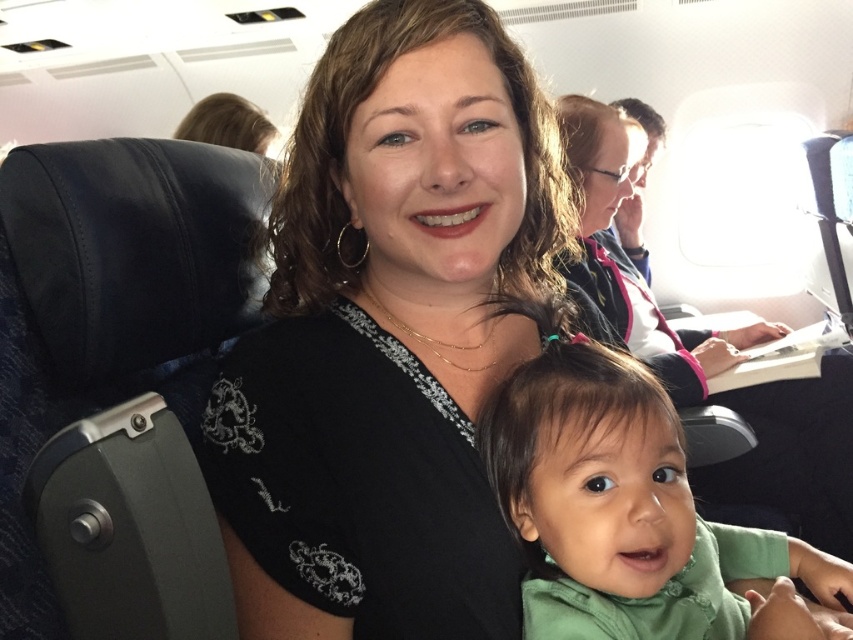
This screenshot has height=640, width=853. What do you see at coordinates (390, 336) in the screenshot?
I see `black embroidered shirt at center` at bounding box center [390, 336].

Find the location of a particular element. The height and width of the screenshot is (640, 853). black embroidered shirt at center is located at coordinates pyautogui.click(x=390, y=336).

I want to click on black embroidered shirt at center, so click(390, 336).